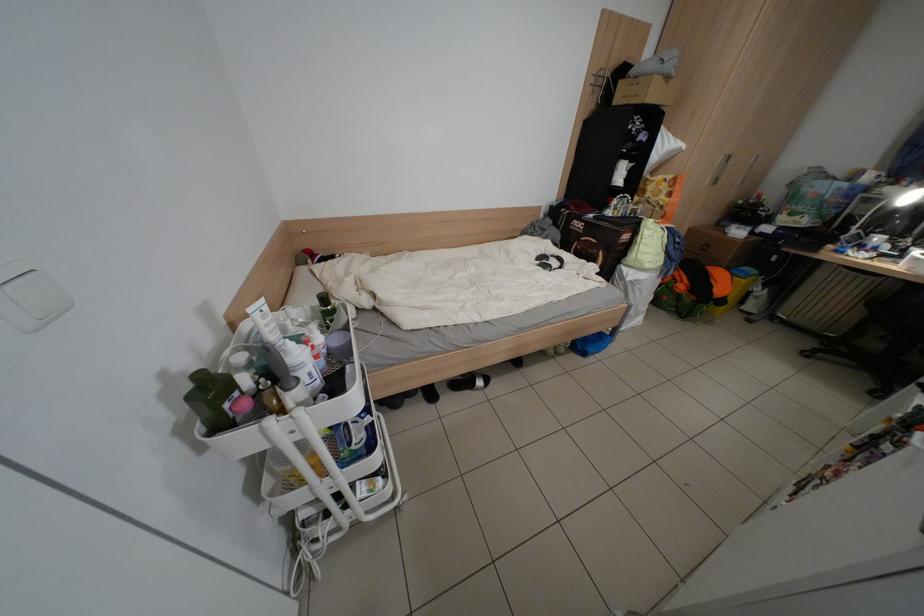
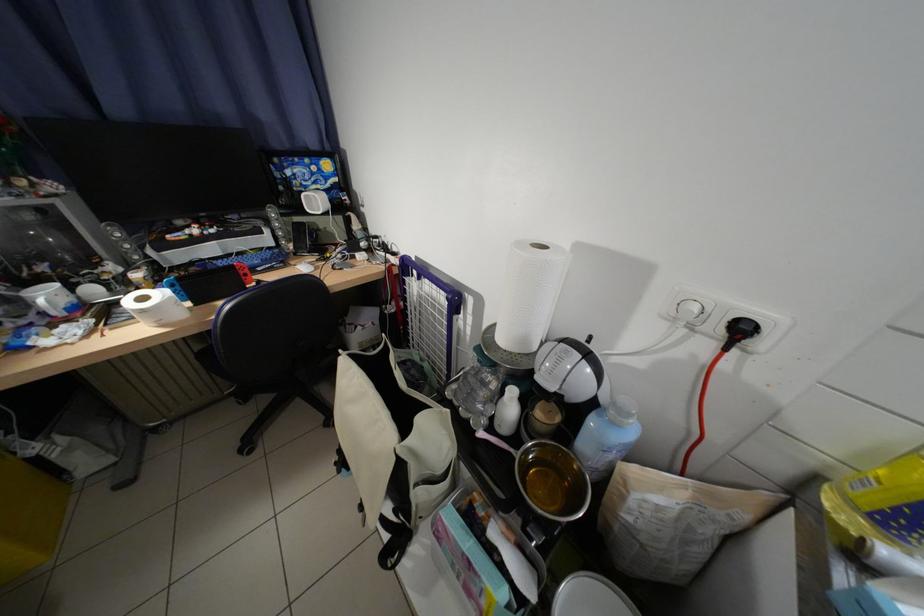
The point at (891, 240) is marked in the first image. Where is the corresponding point in the second image?

(59, 297)